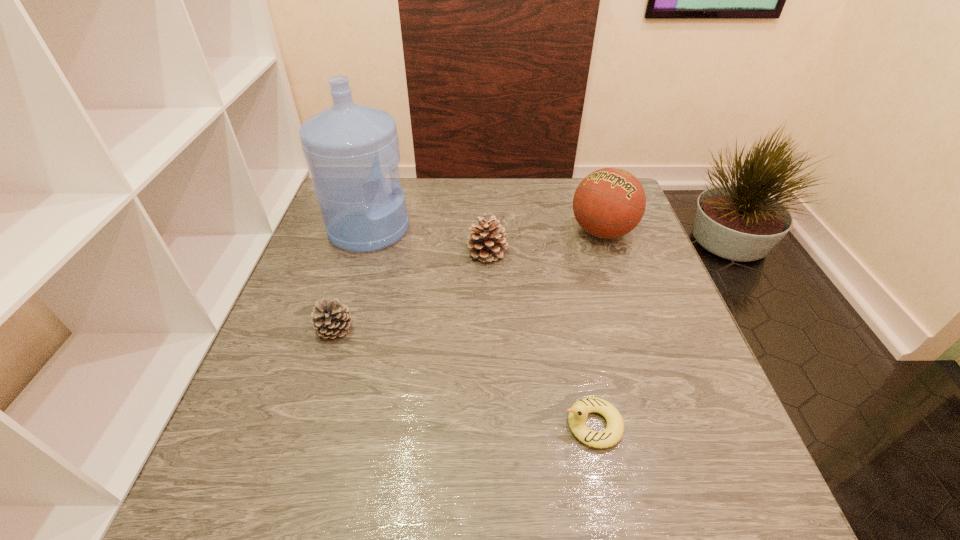
Locate an element on the screen. This screenshot has height=540, width=960. unoccupied position between the nearest object and the fourth farthest object is located at coordinates (464, 377).

The height and width of the screenshot is (540, 960). Find the location of `empty location between the water jug and the fourth tallest object`. empty location between the water jug and the fourth tallest object is located at coordinates (351, 279).

The width and height of the screenshot is (960, 540). I want to click on vacant area that lies between the water jug and the taller pinecone, so click(x=428, y=241).

Image resolution: width=960 pixels, height=540 pixels. Identify the location of free point between the nearest object and the tallest object. (481, 327).

At what (x,y) coordinates should I click in order to perform the action: click on the fourth closest object relative to the shortest object. Please return your answer as a coordinate pair (x, y). The height and width of the screenshot is (540, 960). Looking at the image, I should click on (349, 148).

Identify the location of object that is the fourth closest to the tallest object. (578, 413).

You are a GUI agent. You are given a task and a screenshot of the screen. Output one action in this format:
    pyautogui.click(x=<x>, y=<y>)
    Task: Click on the free space that satisfies the following two spatial constraints: 1. on the side of the water jug with the handle; 2. on the right side of the basketball
    
    Given the screenshot: What is the action you would take?
    pyautogui.click(x=369, y=232)

Locate an element on the screen. This screenshot has height=540, width=960. free space in the image that satisfies the following two spatial constraints: 1. on the side of the basketball with the handle; 2. on the right side of the water jug is located at coordinates (369, 232).

The width and height of the screenshot is (960, 540). What are the coordinates of `vacant space that satisfies the following two spatial constraints: 1. on the side of the second tallest object with the handle; 2. on the left side of the tallest object` in the screenshot? It's located at (369, 232).